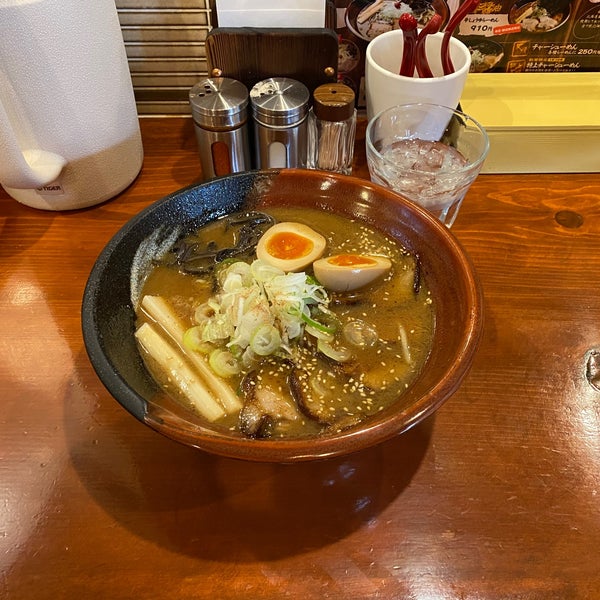
You are a GUI agent. You are given a task and a screenshot of the screen. Output one action in this format:
    pyautogui.click(x=<x>, y=<y>)
    Task: Click on the plastic drinking pitcher
    The image size is (600, 600).
    Given the screenshot: What is the action you would take?
    pyautogui.click(x=54, y=87)